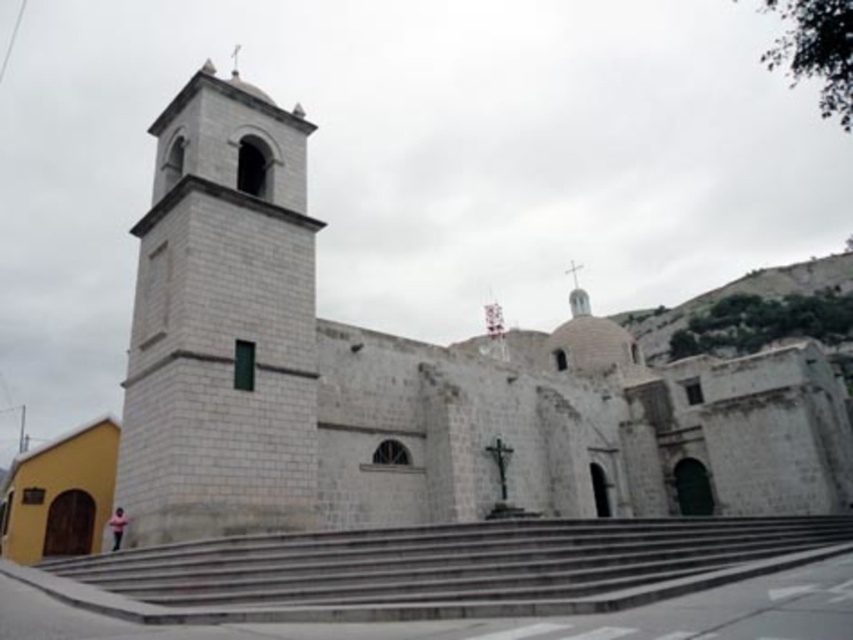
You are standing in front of the historic stone church and want to take a photo of the white stone bell tower at left. If your camera can focus on objects up to 30 meters away, will you need to move closer to get a clear shot?

The white stone bell tower at left is 35.67 meters from the viewer. Since your camera can only focus up to 30 meters, you will need to move closer to ensure the bell tower is within the camera range.

You are standing in front of the historic stone church and want to take a photo of the white stone bell tower at left. To ensure the bell tower is centered in your photo, should you move to the left or right of the crucifix in front of the church?

The white stone bell tower at left is located at point (222, 323), which means it is positioned slightly to the left side of the church. To center it in your photo, you should move to the right of the crucifix to balance the composition.